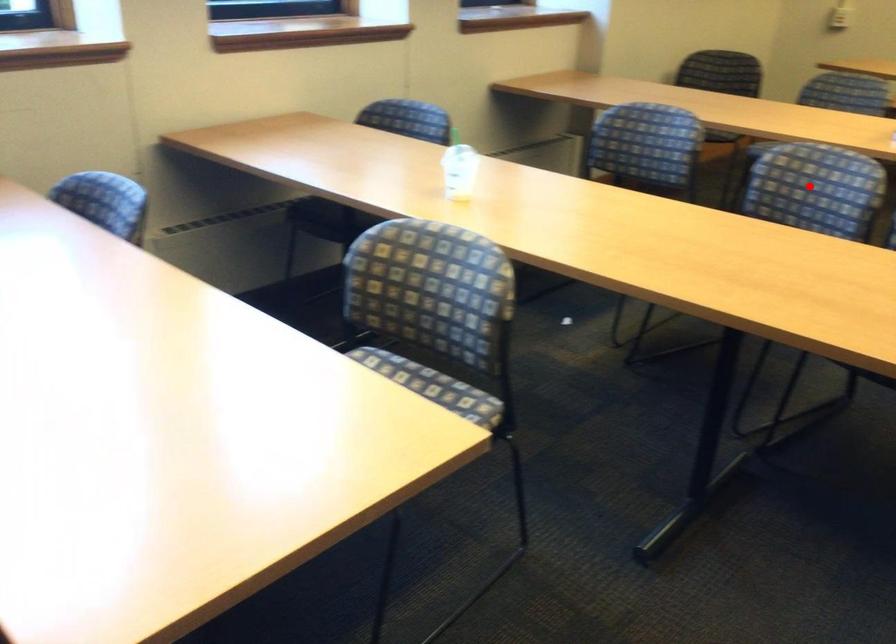
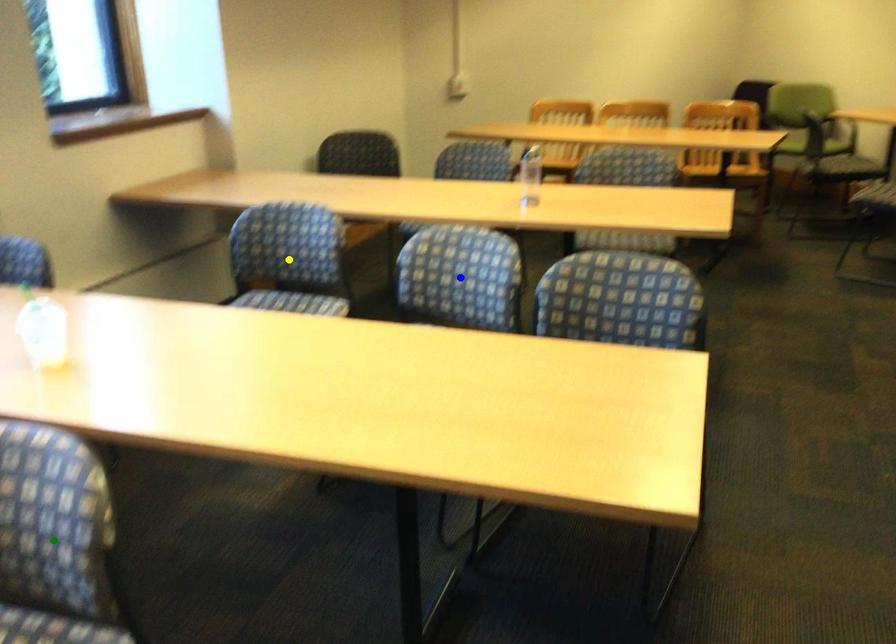
Question: I am providing you with two images of the same scene from different viewpoints. A red point is marked on the first image. You are given multiple points on the second image. Which point in image 2 is actually the same real-world point as the red point in image 1?

Choices:
 (A) blue point
 (B) green point
 (C) yellow point

Answer: (A)